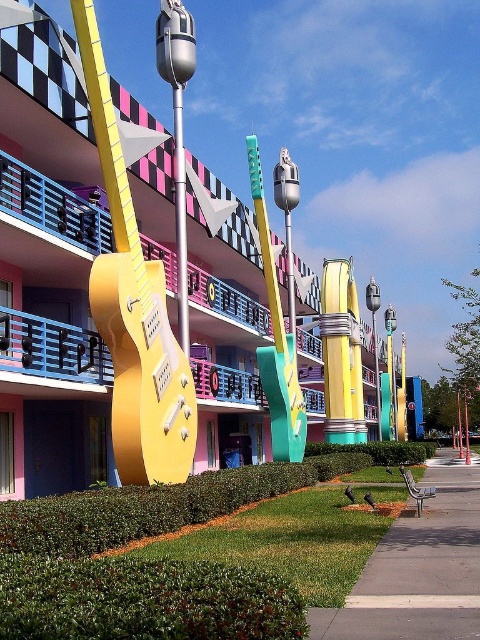
Between point (94, 67) and point (177, 244), which one is positioned in front?

Point (94, 67) is in front.

Is point (164, 408) positioned before point (182, 189)?

Yes.

This screenshot has width=480, height=640. What do you see at coordinates (133, 308) in the screenshot?
I see `gold metallic guitar at center` at bounding box center [133, 308].

Image resolution: width=480 pixels, height=640 pixels. I want to click on gold metallic guitar at center, so click(133, 308).

Is gold metallic guitar at center below teal glossy guitar at center?

No.

In the scene shown: Does gold metallic guitar at center have a greater height compared to teal glossy guitar at center?

No, gold metallic guitar at center is not taller than teal glossy guitar at center.

Locate an element on the screen. Image resolution: width=480 pixels, height=640 pixels. gold metallic guitar at center is located at coordinates (133, 308).

Where is `gold metallic guitar at center`? This screenshot has width=480, height=640. gold metallic guitar at center is located at coordinates (133, 308).

Between teal glossy guitar at center and metallic pole at center, which one appears on the left side from the viewer's perspective?

From the viewer's perspective, metallic pole at center appears more on the left side.

Which is above, teal glossy guitar at center or metallic pole at center?

Positioned higher is metallic pole at center.

Between point (295, 449) and point (181, 300), which one is positioned behind?

Positioned behind is point (295, 449).

This screenshot has height=640, width=480. Find the location of `teal glossy guitar at center`. teal glossy guitar at center is located at coordinates (276, 340).